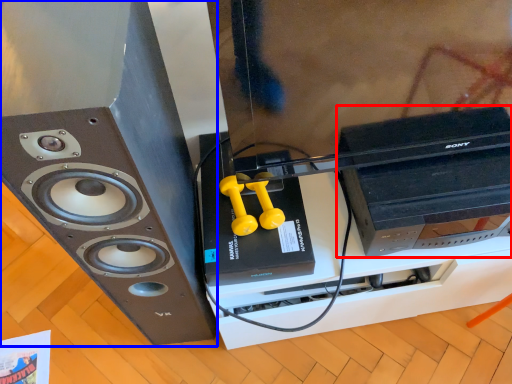
Question: Which point is further to the camera, computer (highlighted by a red box) or home appliance (highlighted by a blue box)?

Choices:
 (A) computer
 (B) home appliance

Answer: (A)